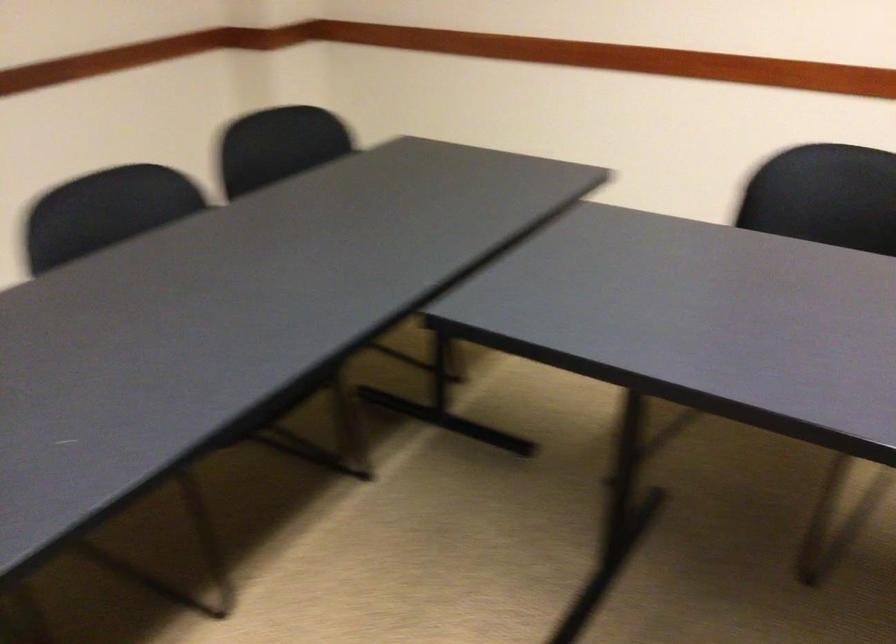
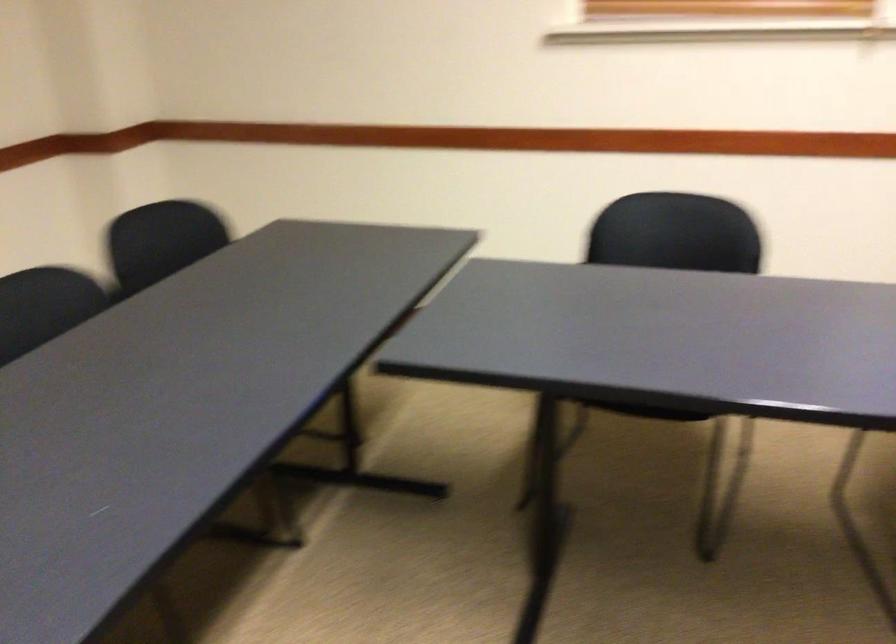
What movement of the cameraman would produce the second image?

The movement direction of the cameraman is left, backward.